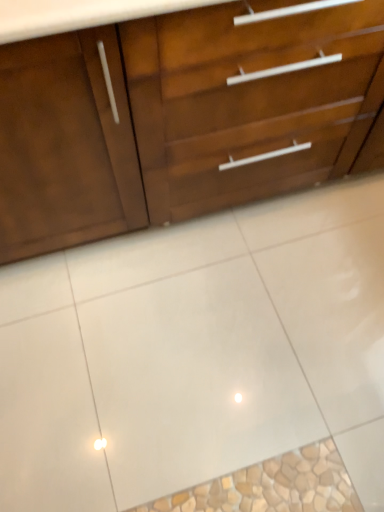
I want to click on matte wood chest of drawers at upper center, so click(185, 116).

The image size is (384, 512). Describe the element at coordinates (185, 116) in the screenshot. I see `matte wood chest of drawers at upper center` at that location.

The height and width of the screenshot is (512, 384). What do you see at coordinates (193, 379) in the screenshot?
I see `white glossy tile at center` at bounding box center [193, 379].

Identify the location of white glossy tile at center. The width and height of the screenshot is (384, 512). (193, 379).

In order to click on matte wood chest of drawers at upper center in this screenshot , I will do `click(185, 116)`.

Visually, is matte wood chest of drawers at upper center positioned to the left or to the right of white glossy tile at center?

From the image, it's evident that matte wood chest of drawers at upper center is to the left of white glossy tile at center.

Which object is more forward, matte wood chest of drawers at upper center or white glossy tile at center?

matte wood chest of drawers at upper center is closer to the camera.

Is point (301, 74) farther from camera compared to point (266, 301)?

No.

From the image's perspective, which object appears higher, matte wood chest of drawers at upper center or white glossy tile at center?

matte wood chest of drawers at upper center.

From a real-world perspective, who is located higher, matte wood chest of drawers at upper center or white glossy tile at center?

matte wood chest of drawers at upper center.

Considering the relative sizes of matte wood chest of drawers at upper center and white glossy tile at center in the image provided, is matte wood chest of drawers at upper center wider than white glossy tile at center?

→ In fact, matte wood chest of drawers at upper center might be narrower than white glossy tile at center.

From their relative heights in the image, would you say matte wood chest of drawers at upper center is taller or shorter than white glossy tile at center?

In the image, matte wood chest of drawers at upper center appears to be taller than white glossy tile at center.

Who is bigger, matte wood chest of drawers at upper center or white glossy tile at center?

matte wood chest of drawers at upper center is bigger.

In the scene shown: Is white glossy tile at center inside matte wood chest of drawers at upper center?

That's incorrect, white glossy tile at center is not inside matte wood chest of drawers at upper center.

Are matte wood chest of drawers at upper center and white glossy tile at center making contact?

matte wood chest of drawers at upper center and white glossy tile at center are clearly separated.

In the scene shown: Is matte wood chest of drawers at upper center oriented away from white glossy tile at center?

matte wood chest of drawers at upper center does not have its back to white glossy tile at center.

How many degrees apart are the facing directions of matte wood chest of drawers at upper center and white glossy tile at center?

The facing directions of matte wood chest of drawers at upper center and white glossy tile at center are 0.191 degrees apart.

You are a GUI agent. You are given a task and a screenshot of the screen. Output one action in this format:
    pyautogui.click(x=<x>, y=<y>)
    Task: Click on the chest of drawers that appears above the white glossy tile at center (from the image's perspective)
    This screenshot has height=512, width=384.
    Given the screenshot: What is the action you would take?
    pyautogui.click(x=185, y=116)

Which object is positioned more to the right, white glossy tile at center or matte wood chest of drawers at upper center?

white glossy tile at center is more to the right.

Looking at this image, is white glossy tile at center further to the viewer compared to matte wood chest of drawers at upper center?

That is True.

Which is closer to the camera, (x=98, y=357) or (x=18, y=239)?

The point (x=18, y=239) is closer.

From the image's perspective, which one is positioned lower, white glossy tile at center or matte wood chest of drawers at upper center?

white glossy tile at center is shown below in the image.

From a real-world perspective, which object rests below the other?

In real-world perspective, white glossy tile at center is lower.

Can you confirm if white glossy tile at center is wider than matte wood chest of drawers at upper center?

Correct, the width of white glossy tile at center exceeds that of matte wood chest of drawers at upper center.

Based on the photo, considering the sizes of objects white glossy tile at center and matte wood chest of drawers at upper center in the image provided, who is taller, white glossy tile at center or matte wood chest of drawers at upper center?

matte wood chest of drawers at upper center is taller.

Which of these two, white glossy tile at center or matte wood chest of drawers at upper center, is smaller?

white glossy tile at center is smaller.

Could matte wood chest of drawers at upper center be considered to be inside white glossy tile at center?

Actually, matte wood chest of drawers at upper center is outside white glossy tile at center.

Is white glossy tile at center far away from matte wood chest of drawers at upper center?

They are positioned close to each other.

Is white glossy tile at center oriented towards matte wood chest of drawers at upper center?

No, white glossy tile at center is not facing towards matte wood chest of drawers at upper center.

How different are the orientations of white glossy tile at center and matte wood chest of drawers at upper center in degrees?

The facing directions of white glossy tile at center and matte wood chest of drawers at upper center are 0.191 degrees apart.

Image resolution: width=384 pixels, height=512 pixels. Identify the location of ceramic tile beneath the matte wood chest of drawers at upper center (from a real-world perspective). (193, 379).

Where is `the chest of drawers that is in front of the white glossy tile at center`? The height and width of the screenshot is (512, 384). the chest of drawers that is in front of the white glossy tile at center is located at coordinates (185, 116).

Image resolution: width=384 pixels, height=512 pixels. Find the location of `chest of drawers located on the left of white glossy tile at center`. chest of drawers located on the left of white glossy tile at center is located at coordinates (185, 116).